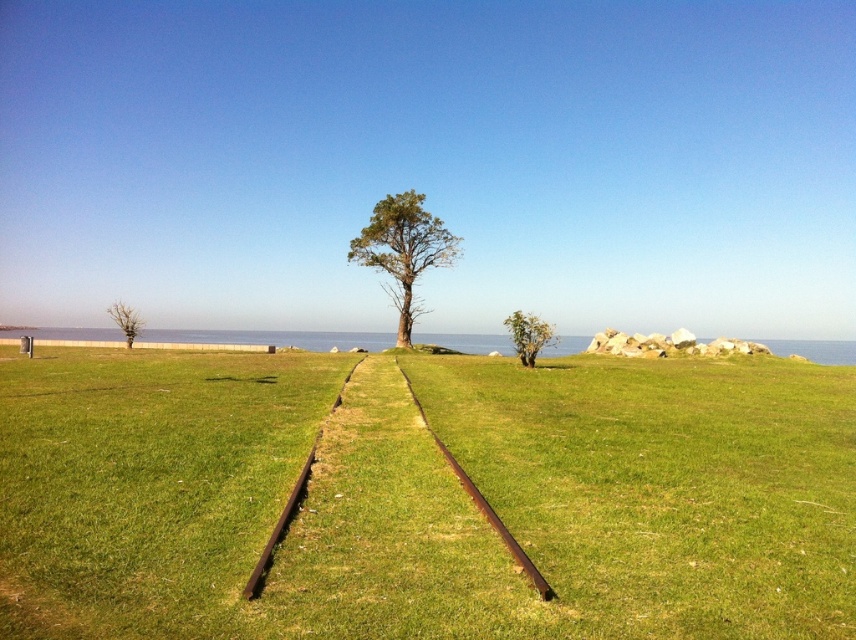
This screenshot has height=640, width=856. Identify the location of green grassy at center. (428, 497).

Between green grassy at center and green leafy tree at right, which one is positioned higher?

Positioned higher is green leafy tree at right.

Between point (800, 508) and point (544, 339), which one is positioned in front?

Point (800, 508) is in front.

Where is `green grassy at center`? The width and height of the screenshot is (856, 640). green grassy at center is located at coordinates (428, 497).

Who is more distant from viewer, (480, 499) or (522, 310)?

Positioned behind is point (522, 310).

The width and height of the screenshot is (856, 640). Describe the element at coordinates (483, 502) in the screenshot. I see `rusty metal train track at center` at that location.

The height and width of the screenshot is (640, 856). Find the location of `rusty metal train track at center`. rusty metal train track at center is located at coordinates (483, 502).

Consider the image. Measure the distance between green leafy tree at right and green leafy tree at lower left.

A distance of 130.35 feet exists between green leafy tree at right and green leafy tree at lower left.

Locate an element on the screen. The width and height of the screenshot is (856, 640). green leafy tree at right is located at coordinates (528, 336).

Is point (515, 332) positioned in front of point (122, 321)?

Yes, it is in front of point (122, 321).

I want to click on green leafy tree at right, so click(528, 336).